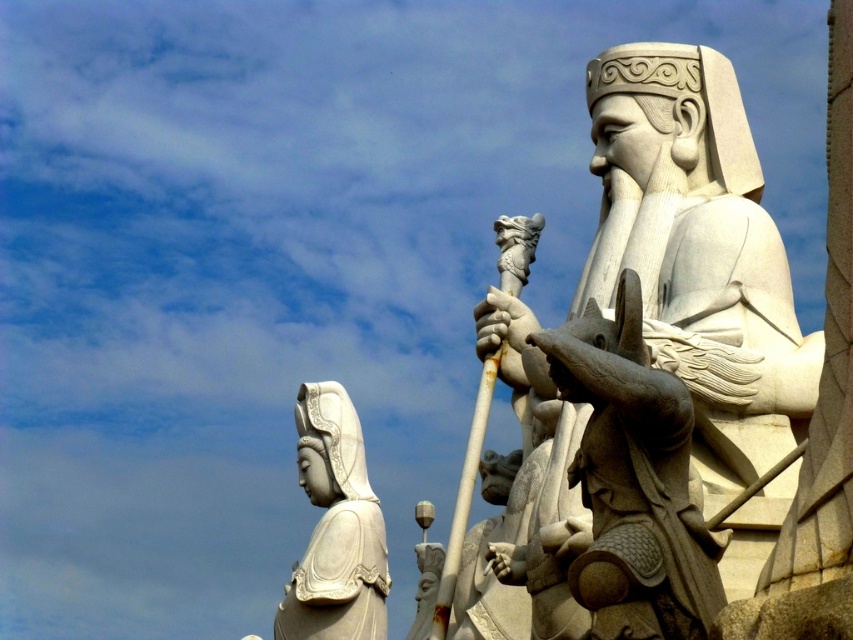
You are an art conservator assessing the placement of the statues in the image. Given that the white stone statue at right is positioned higher than the white stone statue at lower left, which statue would require a taller base to ensure both are at the same height?

The white stone statue at lower left would need a taller base because it is positioned lower than the white stone statue at right.